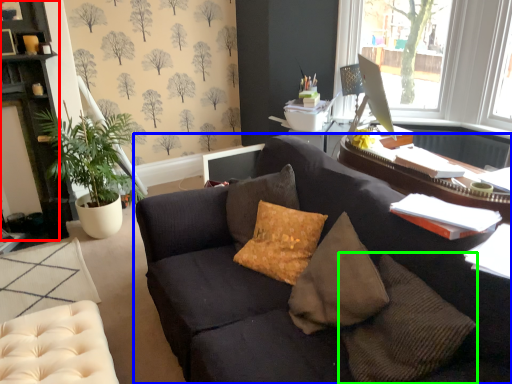
Question: Considering the real-world distances, which object is farthest from cabinetry (highlighted by a red box)? studio couch (highlighted by a blue box) or pillow (highlighted by a green box)?

Choices:
 (A) studio couch
 (B) pillow

Answer: (B)